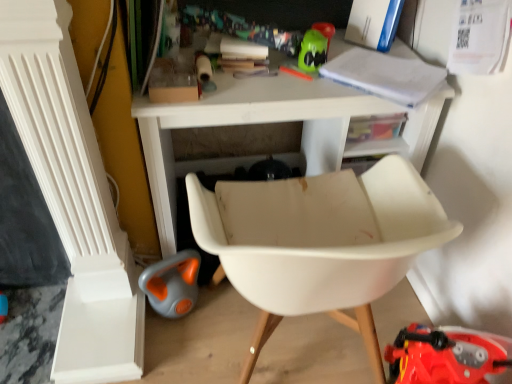
Question: Is point (250, 269) closer or farther from the camera than point (282, 114)?

Choices:
 (A) closer
 (B) farther

Answer: (A)

Question: Considering the positions of white plastic chair at center and white matte table at upper center in the image, is white plastic chair at center bigger or smaller than white matte table at upper center?

Choices:
 (A) big
 (B) small

Answer: (B)

Question: Would you say white plastic chair at center is inside or outside white matte table at upper center?

Choices:
 (A) outside
 (B) inside

Answer: (A)

Question: From the image's perspective, relative to white plastic chair at center, is white matte table at upper center above or below?

Choices:
 (A) below
 (B) above

Answer: (B)

Question: In the image, is white matte table at upper center on the left side or the right side of white plastic chair at center?

Choices:
 (A) right
 (B) left

Answer: (B)

Question: In terms of width, does white matte table at upper center look wider or thinner when compared to white plastic chair at center?

Choices:
 (A) wide
 (B) thin

Answer: (B)

Question: Which is correct: white matte table at upper center is inside white plastic chair at center, or outside of it?

Choices:
 (A) inside
 (B) outside

Answer: (B)